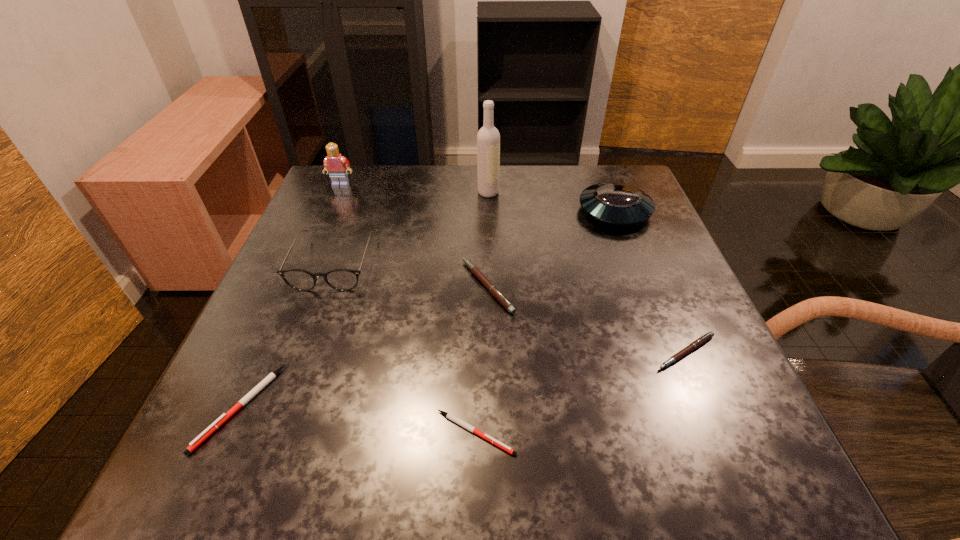
This screenshot has width=960, height=540. I want to click on vacant region located 0.190m at the nib of the right pink pen, so click(745, 492).

What are the coordinates of `vacant space located on the clicker of the shortest object` in the screenshot? It's located at (742, 433).

Locate an element on the screen. This screenshot has width=960, height=540. vodka located at the far edge is located at coordinates (488, 138).

This screenshot has width=960, height=540. In order to click on Lego that is positioned at the far edge in this screenshot , I will do `click(335, 164)`.

Find the location of a particular element. saucer at the far edge is located at coordinates (617, 203).

The image size is (960, 540). I want to click on Lego present at the left edge, so click(335, 164).

Find the location of a particular element. This screenshot has height=540, width=960. spectacles at the left edge is located at coordinates (339, 279).

This screenshot has width=960, height=540. Find the location of `pen present at the left edge`. pen present at the left edge is located at coordinates (224, 417).

Where is `saucer that is at the right edge`? This screenshot has height=540, width=960. saucer that is at the right edge is located at coordinates (617, 203).

Locate an element on the screen. The image size is (960, 540). pen located at the right edge is located at coordinates (709, 335).